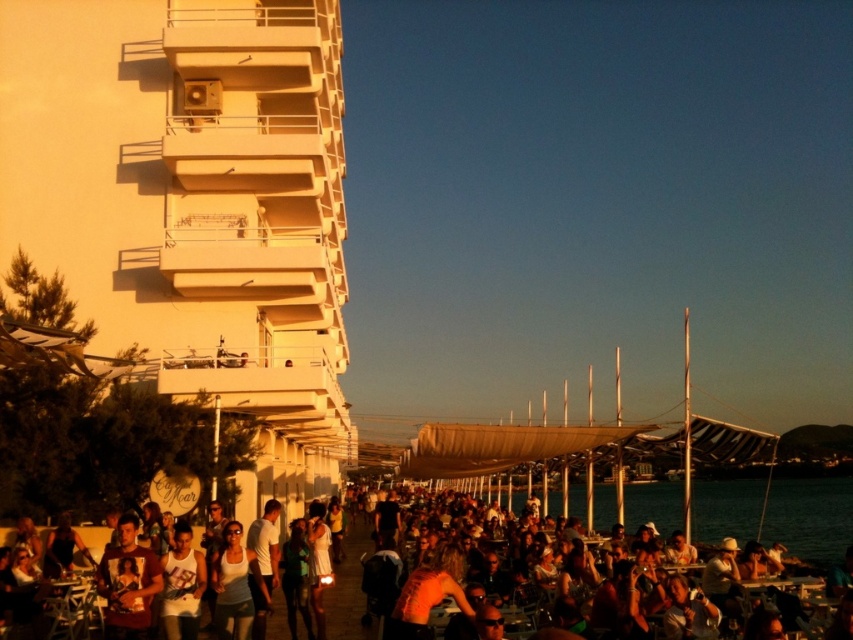
Question: Among these objects, which one is nearest to the camera?

Choices:
 (A) orange tank top at center
 (B) white matte tank top at center

Answer: (B)

Question: Can you confirm if orange tank top at center is positioned to the right of white matte tank top at center?

Choices:
 (A) yes
 (B) no

Answer: (A)

Question: Which object is closer to the camera taking this photo?

Choices:
 (A) orange tank top at center
 (B) white matte tank top at center

Answer: (B)

Question: Is orange tank top at center wider than white matte tank top at center?

Choices:
 (A) yes
 (B) no

Answer: (A)

Question: Is the position of orange tank top at center less distant than that of white matte tank top at center?

Choices:
 (A) no
 (B) yes

Answer: (A)